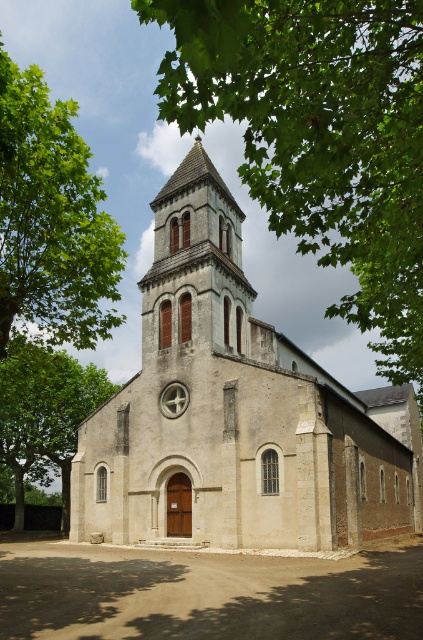
You are a photographer planning to take a photo of the green leafy tree at upper center and the smooth stone spire at center. Considering their sizes, which object should you focus on to ensure it fills the frame better?

The green leafy tree at upper center is larger in size than the smooth stone spire at center, so focusing on the green leafy tree at upper center would fill the frame better.

You are a photographer planning to capture the beige stone church at center and the green leafy tree at left in a single shot. Based on their positions, which one would appear closer to the camera in the final photograph?

The beige stone church at center appears closer to the camera than the green leafy tree at left because it is positioned below it in the image.

You are a photographer planning to capture the entire view of the church and its surroundings. You notice the green leafy tree at upper center and the smooth stone spire at center. Which object is wider in the image?

The green leafy tree at upper center is wider than the smooth stone spire at center.